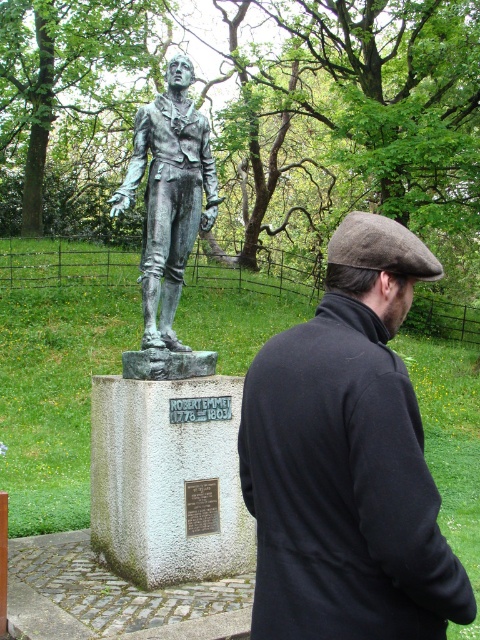
Question: Does dark brown woolen cap at center appear under bronze statue at center?

Choices:
 (A) no
 (B) yes

Answer: (B)

Question: Which point appears closest to the camera in this image?

Choices:
 (A) (374, 486)
 (B) (183, 209)

Answer: (A)

Question: Is dark brown woolen cap at center in front of bronze statue at center?

Choices:
 (A) no
 (B) yes

Answer: (B)

Question: Can you confirm if dark brown woolen cap at center is positioned below bronze statue at center?

Choices:
 (A) no
 (B) yes

Answer: (B)

Question: Which of the following is the closest to the observer?

Choices:
 (A) dark brown woolen cap at center
 (B) bronze statue at center

Answer: (A)